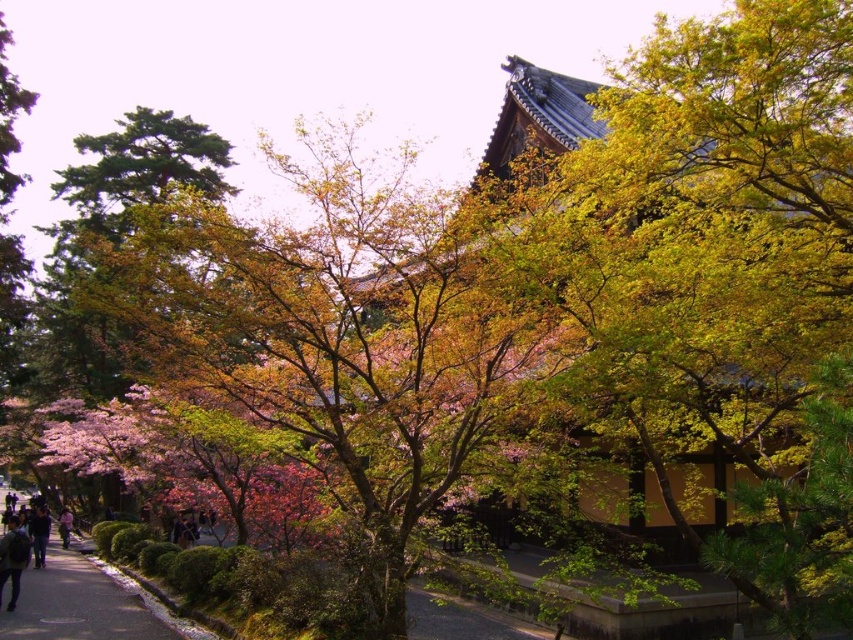
Question: Is dark blue backpack at lower left wider than pink fabric at lower left?

Choices:
 (A) no
 (B) yes

Answer: (B)

Question: Can you confirm if paved asphalt sidewalk at lower left is smaller than dark blue jeans at lower left?

Choices:
 (A) yes
 (B) no

Answer: (B)

Question: Can you confirm if dark blue backpack at lower left is wider than pink fabric at lower left?

Choices:
 (A) no
 (B) yes

Answer: (B)

Question: Which point is closer to the camera?

Choices:
 (A) dark blue backpack at lower left
 (B) pink fabric at lower left
 (C) dark blue jeans at lower left
 (D) paved asphalt sidewalk at lower left

Answer: (D)

Question: Which object is positioned farthest from the paved asphalt sidewalk at lower left?

Choices:
 (A) dark blue backpack at lower left
 (B) pink fabric at lower left

Answer: (B)

Question: Which is nearer to the pink fabric at lower left?

Choices:
 (A) dark blue jeans at lower left
 (B) dark blue backpack at lower left

Answer: (A)